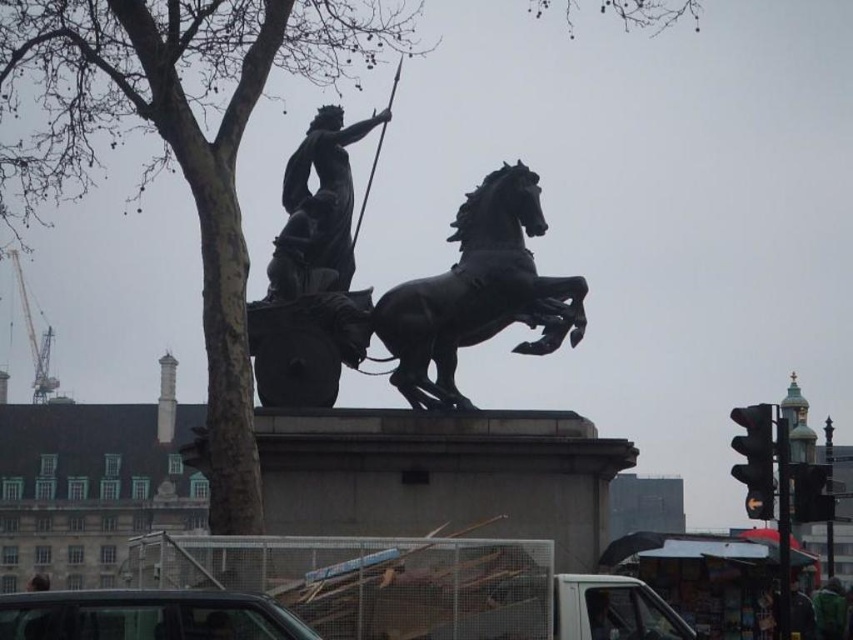
Question: Which point is closer to the camera?

Choices:
 (A) (339, 179)
 (B) (495, 220)

Answer: (B)

Question: Which object is positioned closest to the polished bronze horse at center?

Choices:
 (A) bare wood tree at upper left
 (B) bronze statue at center

Answer: (B)

Question: Observing the image, what is the correct spatial positioning of bare wood tree at upper left in reference to polished bronze horse at center?

Choices:
 (A) above
 (B) below

Answer: (A)

Question: Which object is closer to the camera taking this photo?

Choices:
 (A) bare wood tree at upper left
 (B) bronze statue at center
 (C) polished bronze horse at center

Answer: (A)

Question: Does bare wood tree at upper left come in front of bronze statue at center?

Choices:
 (A) yes
 (B) no

Answer: (A)

Question: Can you confirm if bare wood tree at upper left is wider than polished bronze horse at center?

Choices:
 (A) no
 (B) yes

Answer: (B)